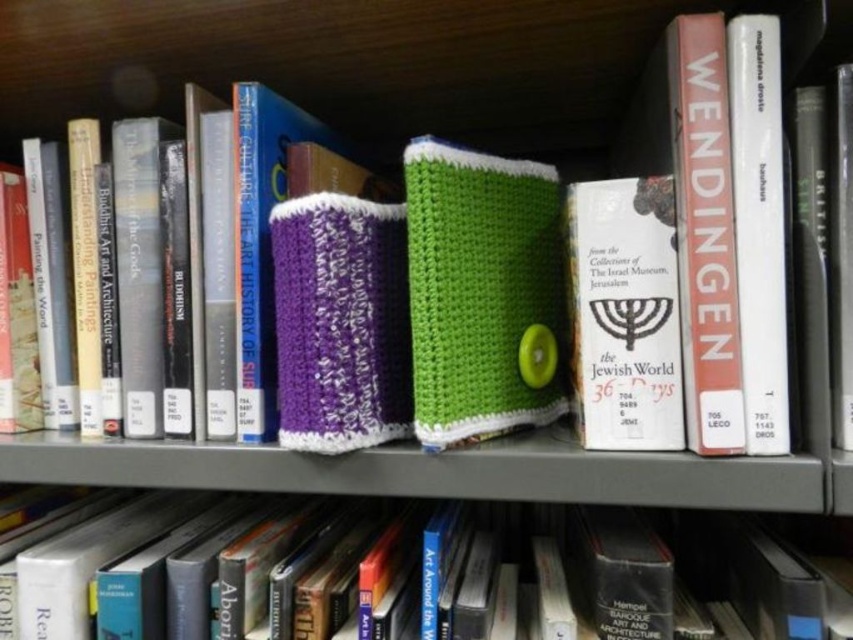
Question: Which point is farther to the camera?

Choices:
 (A) hardcover book at center
 (B) green knitted book at center

Answer: (B)

Question: Can you confirm if green knitted book at center is positioned to the right of white paper book at upper right?

Choices:
 (A) no
 (B) yes

Answer: (A)

Question: Among these points, which one is nearest to the camera?

Choices:
 (A) (770, 212)
 (B) (611, 627)
 (C) (532, 422)
 (D) (595, 316)

Answer: (A)

Question: Which object appears farthest from the camera in this image?

Choices:
 (A) matte pink hardcover book at upper right
 (B) white paper book at center

Answer: (B)

Question: Is hardcover book at center bigger than green knitted book at center?

Choices:
 (A) yes
 (B) no

Answer: (A)

Question: Does hardcover book at center appear on the right side of green knitted book at center?

Choices:
 (A) no
 (B) yes

Answer: (A)